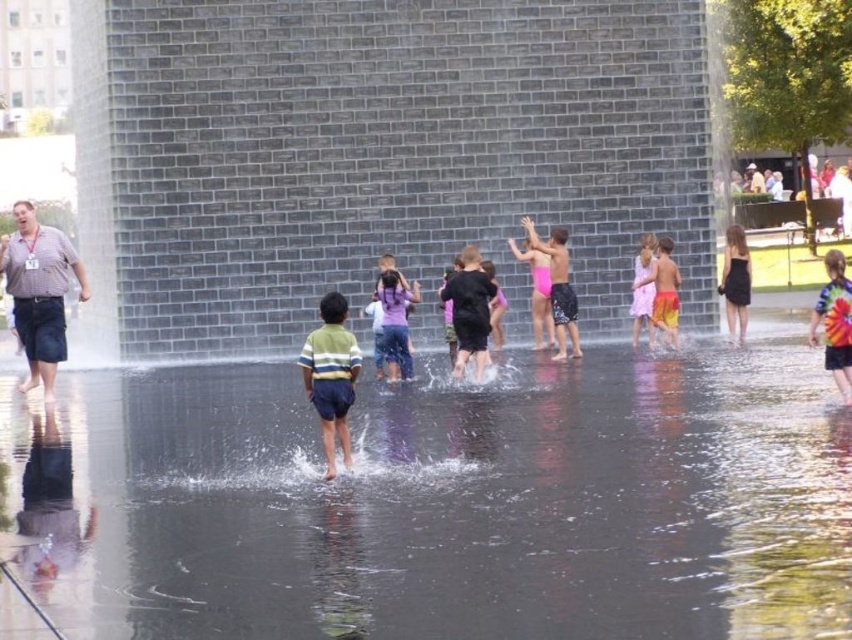
Question: Which is farther from the tie-dye fabric shorts at center?

Choices:
 (A) striped shirt shorts at center left
 (B) clear water at center
 (C) striped cotton shirt at center
 (D) black satin dress at right

Answer: (A)

Question: Can you confirm if clear water at center is positioned below black satin dress at right?

Choices:
 (A) no
 (B) yes

Answer: (B)

Question: Is tie-dye fabric shorts at center to the left of black satin dress at right from the viewer's perspective?

Choices:
 (A) yes
 (B) no

Answer: (B)

Question: Which of these objects is positioned farthest from the striped shirt shorts at center left?

Choices:
 (A) striped cotton shirt at center
 (B) clear water at center
 (C) black satin dress at right

Answer: (C)

Question: Based on their relative distances, which object is nearer to the striped shirt shorts at center left?

Choices:
 (A) clear water at center
 (B) striped cotton shirt at center
 (C) black satin dress at right
 (D) tie-dye fabric shorts at center

Answer: (A)

Question: Can you confirm if striped cotton shirt at center is bigger than tie-dye fabric shorts at center?

Choices:
 (A) yes
 (B) no

Answer: (B)